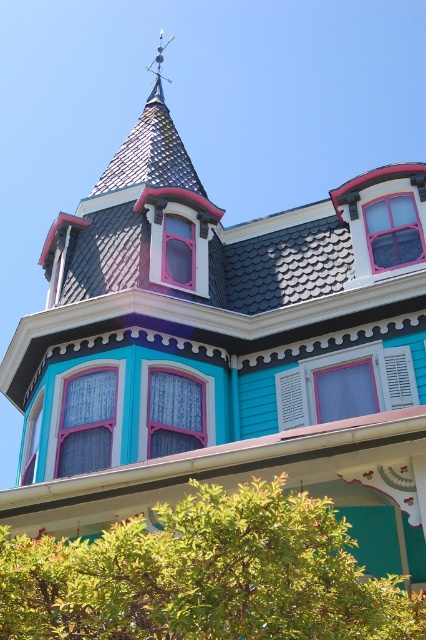
You are standing in front of the Victorian house and notice the green leafy tree at lower center and the shiny metal spire at upper center. Which object is positioned higher up in the image?

The shiny metal spire at upper center is positioned higher up in the image than the green leafy tree at lower center.

You are standing in front of the Victorian house and notice both the green leafy tree at lower center and the shiny metal spire at upper center. From your vantage point, which object is positioned to the right of the other?

The green leafy tree at lower center is to the right of the shiny metal spire at upper center.

You are a painter standing at the base of the green leafy tree at lower center. You want to paint the shiny metal spire at upper center but need to know if the tree is wider than the spire. Can you determine this without moving?

The green leafy tree at lower center is narrower than the shiny metal spire at upper center, so the tree is not wider than the spire.